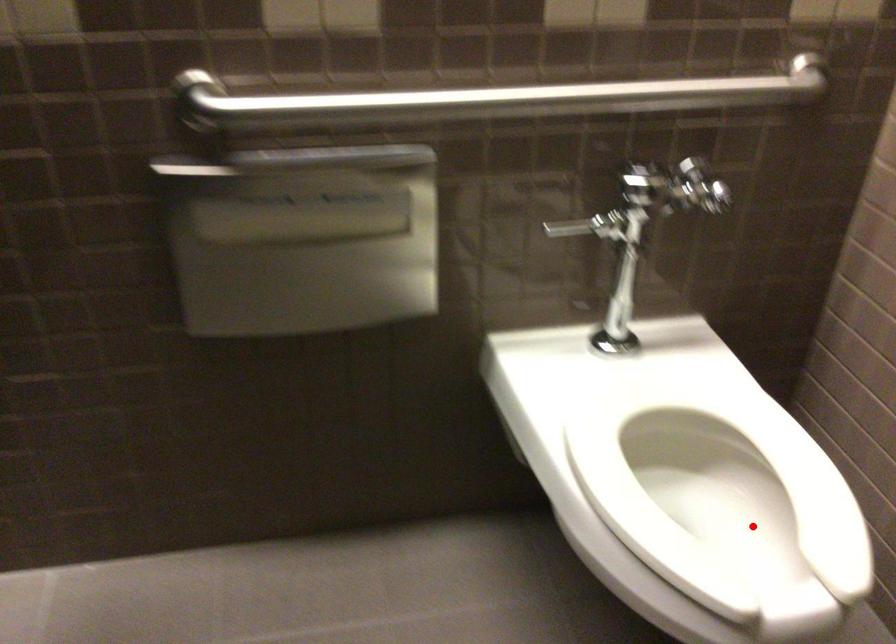
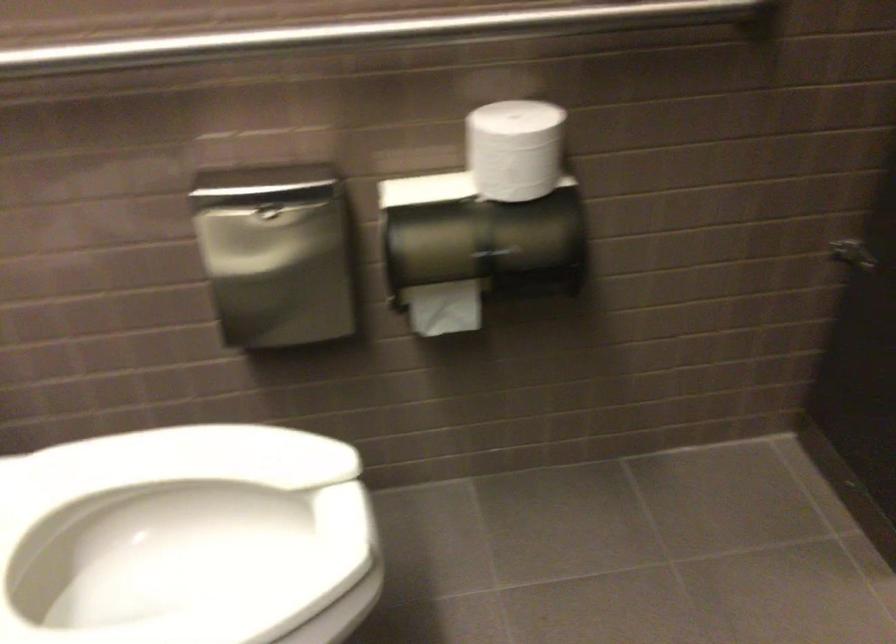
Question: I am providing you with two images of the same scene from different viewpoints. A red point is shown in image1. For the corresponding object point in image2, is it positioned nearer or farther from the camera?

Choices:
 (A) Nearer
 (B) Farther

Answer: (A)